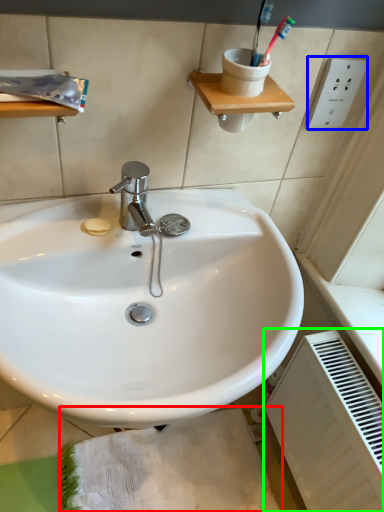
Question: Which object is the closest to the bath mat (highlighted by a red box)? Choose among these: electric outlet (highlighted by a blue box) or radiator (highlighted by a green box).

Choices:
 (A) electric outlet
 (B) radiator

Answer: (B)